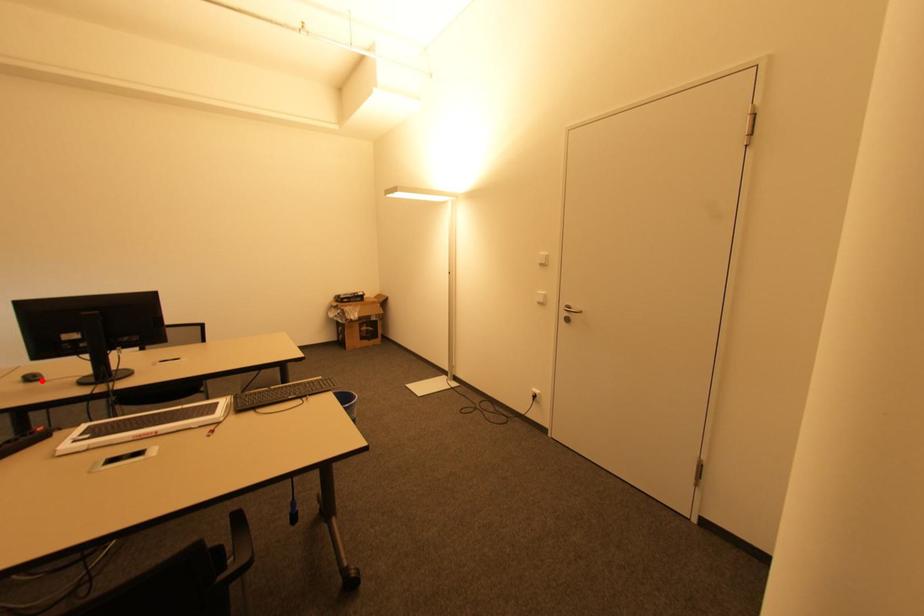
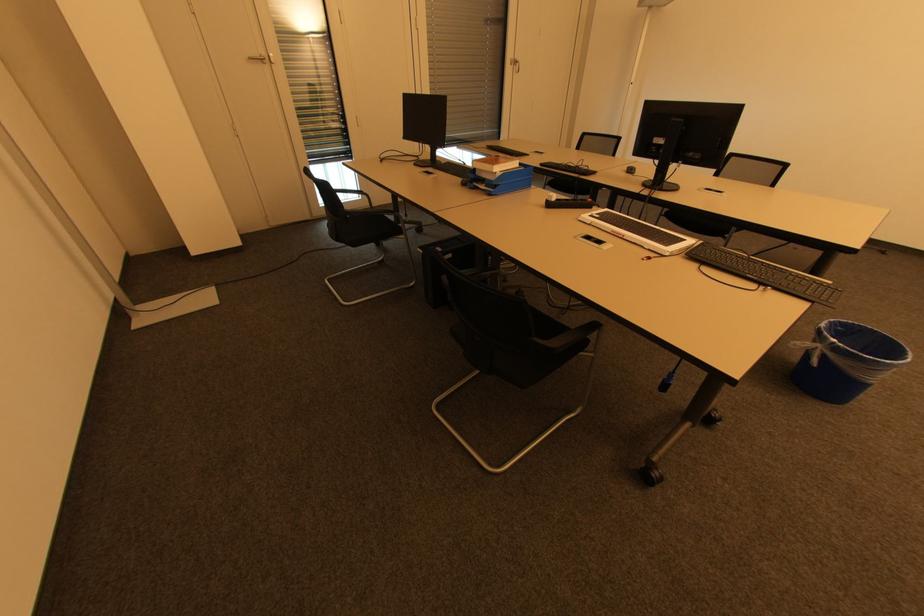
Question: I am providing you with two images of the same scene from different viewpoints. Given a red point in image1, look at the same physical point in image2. Is it:

Choices:
 (A) Closer to the viewpoint
 (B) Farther from the viewpoint

Answer: (A)